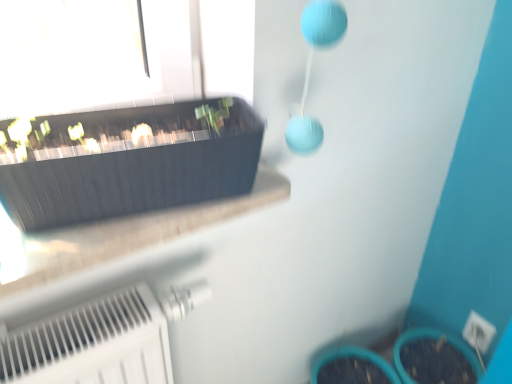
Where is `matte black flowerpot at upper left`? The image size is (512, 384). matte black flowerpot at upper left is located at coordinates (131, 162).

This screenshot has height=384, width=512. What do you see at coordinates (131, 162) in the screenshot? I see `matte black flowerpot at upper left` at bounding box center [131, 162].

This screenshot has height=384, width=512. What do you see at coordinates (478, 332) in the screenshot?
I see `white plastic electric outlet at lower right` at bounding box center [478, 332].

Locate an element on the screen. The height and width of the screenshot is (384, 512). white plastic electric outlet at lower right is located at coordinates (478, 332).

What is the approximate width of white plastic electric outlet at lower right?

It is 1.87 inches.

Locate an element on the screen. The height and width of the screenshot is (384, 512). matte black flowerpot at upper left is located at coordinates (131, 162).

In the scene shown: Considering the relative positions of white plastic electric outlet at lower right and matte black flowerpot at upper left in the image provided, is white plastic electric outlet at lower right to the left of matte black flowerpot at upper left from the viewer's perspective?

In fact, white plastic electric outlet at lower right is to the right of matte black flowerpot at upper left.

Is the depth of white plastic electric outlet at lower right less than that of matte black flowerpot at upper left?

No, white plastic electric outlet at lower right is further to the viewer.

Between point (481, 349) and point (105, 126), which one is positioned behind?

The point (481, 349) is more distant.

From the image's perspective, which is above, white plastic electric outlet at lower right or matte black flowerpot at upper left?

matte black flowerpot at upper left.

From a real-world perspective, is white plastic electric outlet at lower right positioned above or below matte black flowerpot at upper left?

From a real-world perspective, white plastic electric outlet at lower right is physically below matte black flowerpot at upper left.

Consider the image. Considering the relative sizes of white plastic electric outlet at lower right and matte black flowerpot at upper left in the image provided, is white plastic electric outlet at lower right wider than matte black flowerpot at upper left?

In fact, white plastic electric outlet at lower right might be narrower than matte black flowerpot at upper left.

From the picture: Is white plastic electric outlet at lower right taller than matte black flowerpot at upper left?

No.

Considering the relative sizes of white plastic electric outlet at lower right and matte black flowerpot at upper left in the image provided, is white plastic electric outlet at lower right bigger than matte black flowerpot at upper left?

No, white plastic electric outlet at lower right is not bigger than matte black flowerpot at upper left.

Based on the photo, is matte black flowerpot at upper left surrounded by white plastic electric outlet at lower right?

That's incorrect, matte black flowerpot at upper left is not inside white plastic electric outlet at lower right.

Consider the image. Is white plastic electric outlet at lower right next to matte black flowerpot at upper left?

No, white plastic electric outlet at lower right is not next to matte black flowerpot at upper left.

Is white plastic electric outlet at lower right oriented away from matte black flowerpot at upper left?

white plastic electric outlet at lower right is not turned away from matte black flowerpot at upper left.

How many degrees apart are the facing directions of white plastic electric outlet at lower right and matte black flowerpot at upper left?

There is a 77.7-degree angle between the facing directions of white plastic electric outlet at lower right and matte black flowerpot at upper left.

There is a white plastic electric outlet at lower right. Identify the location of flowerpot above it (from a real-world perspective). The image size is (512, 384). (131, 162).

Considering the positions of objects matte black flowerpot at upper left and white plastic electric outlet at lower right in the image provided, who is more to the right, matte black flowerpot at upper left or white plastic electric outlet at lower right?

Positioned to the right is white plastic electric outlet at lower right.

Which object is further away from the camera taking this photo, matte black flowerpot at upper left or white plastic electric outlet at lower right?

white plastic electric outlet at lower right.

Is point (106, 125) more distant than point (488, 331)?

That is False.

From the image's perspective, is matte black flowerpot at upper left positioned above or below white plastic electric outlet at lower right?

matte black flowerpot at upper left is situated higher than white plastic electric outlet at lower right in the image.

From a real-world perspective, which object rests below the other?

In real-world perspective, white plastic electric outlet at lower right is lower.

Is matte black flowerpot at upper left thinner than white plastic electric outlet at lower right?

No, matte black flowerpot at upper left is not thinner than white plastic electric outlet at lower right.

In the scene shown: Between matte black flowerpot at upper left and white plastic electric outlet at lower right, which one has less height?

white plastic electric outlet at lower right is shorter.

Does matte black flowerpot at upper left have a smaller size compared to white plastic electric outlet at lower right?

No, matte black flowerpot at upper left is not smaller than white plastic electric outlet at lower right.

Is matte black flowerpot at upper left surrounding white plastic electric outlet at lower right?

Actually, white plastic electric outlet at lower right is outside matte black flowerpot at upper left.

Consider the image. Is matte black flowerpot at upper left placed right next to white plastic electric outlet at lower right?

matte black flowerpot at upper left is not next to white plastic electric outlet at lower right, and they're not touching.

Is matte black flowerpot at upper left turned away from white plastic electric outlet at lower right?

No, matte black flowerpot at upper left is not facing the opposite direction of white plastic electric outlet at lower right.

What's the angular difference between matte black flowerpot at upper left and white plastic electric outlet at lower right's facing directions?

The angle between the facing direction of matte black flowerpot at upper left and the facing direction of white plastic electric outlet at lower right is 77.7 degrees.

Find the location of a particular element. The width and height of the screenshot is (512, 384). electric outlet behind the matte black flowerpot at upper left is located at coordinates (478, 332).

I want to click on electric outlet directly beneath the matte black flowerpot at upper left (from a real-world perspective), so click(478, 332).

The image size is (512, 384). I want to click on electric outlet on the right of matte black flowerpot at upper left, so click(x=478, y=332).